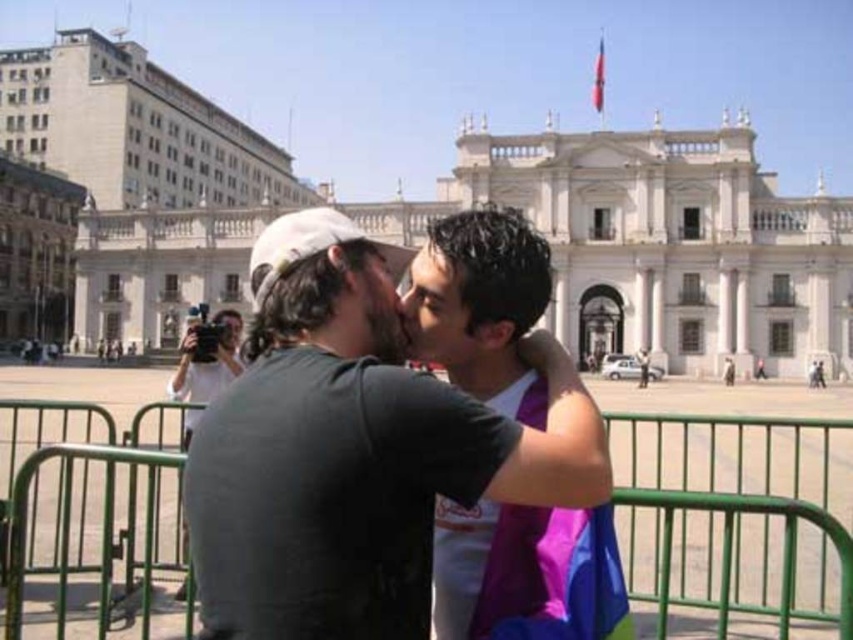
Question: Observing the image, what is the correct spatial positioning of white stone building at center in reference to green metal fence at center?

Choices:
 (A) right
 (B) left

Answer: (B)

Question: Estimate the real-world distances between objects in this image. Which object is farther from the purple fabric at center?

Choices:
 (A) matte black t-shirt at center
 (B) white stone building at center

Answer: (B)

Question: Among these points, which one is nearest to the camera?

Choices:
 (A) (775, 323)
 (B) (511, 604)

Answer: (B)

Question: Which point is farther to the camera?

Choices:
 (A) (512, 536)
 (B) (389, 556)
 (C) (704, 467)

Answer: (C)

Question: Observing the image, what is the correct spatial positioning of matte black t-shirt at center in reference to white fabric camera at center?

Choices:
 (A) above
 (B) below

Answer: (A)

Question: Does white stone building at center appear over purple fabric at center?

Choices:
 (A) yes
 (B) no

Answer: (A)